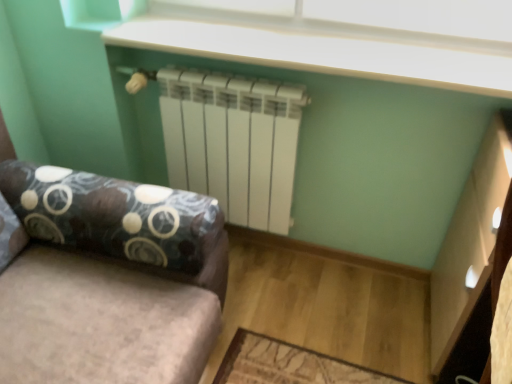
Question: Does velvet fabric studio couch at center appear on the right side of white plastic window screen at upper center?

Choices:
 (A) no
 (B) yes

Answer: (A)

Question: Is velvet fabric studio couch at center facing towards white plastic window screen at upper center?

Choices:
 (A) no
 (B) yes

Answer: (A)

Question: Considering the relative sizes of velvet fabric studio couch at center and white plastic window screen at upper center in the image provided, is velvet fabric studio couch at center thinner than white plastic window screen at upper center?

Choices:
 (A) no
 (B) yes

Answer: (A)

Question: Considering the relative sizes of velvet fabric studio couch at center and white plastic window screen at upper center in the image provided, is velvet fabric studio couch at center shorter than white plastic window screen at upper center?

Choices:
 (A) no
 (B) yes

Answer: (A)

Question: Is the depth of velvet fabric studio couch at center greater than that of white plastic window screen at upper center?

Choices:
 (A) no
 (B) yes

Answer: (A)

Question: Considering the relative sizes of velvet fabric studio couch at center and white plastic window screen at upper center in the image provided, is velvet fabric studio couch at center bigger than white plastic window screen at upper center?

Choices:
 (A) yes
 (B) no

Answer: (A)

Question: Would you say white matte radiator at center is part of white plastic window screen at upper center's contents?

Choices:
 (A) no
 (B) yes

Answer: (A)

Question: Is white plastic window screen at upper center next to white matte radiator at center?

Choices:
 (A) yes
 (B) no

Answer: (B)

Question: Does white plastic window screen at upper center come behind white matte radiator at center?

Choices:
 (A) no
 (B) yes

Answer: (A)

Question: Could you tell me if white plastic window screen at upper center is facing white matte radiator at center?

Choices:
 (A) no
 (B) yes

Answer: (A)

Question: Can you confirm if white plastic window screen at upper center is thinner than white matte radiator at center?

Choices:
 (A) no
 (B) yes

Answer: (B)

Question: From the image's perspective, does white plastic window screen at upper center appear higher than white matte radiator at center?

Choices:
 (A) yes
 (B) no

Answer: (A)

Question: Is white plastic window screen at upper center directly adjacent to velvet fabric studio couch at center?

Choices:
 (A) no
 (B) yes

Answer: (A)